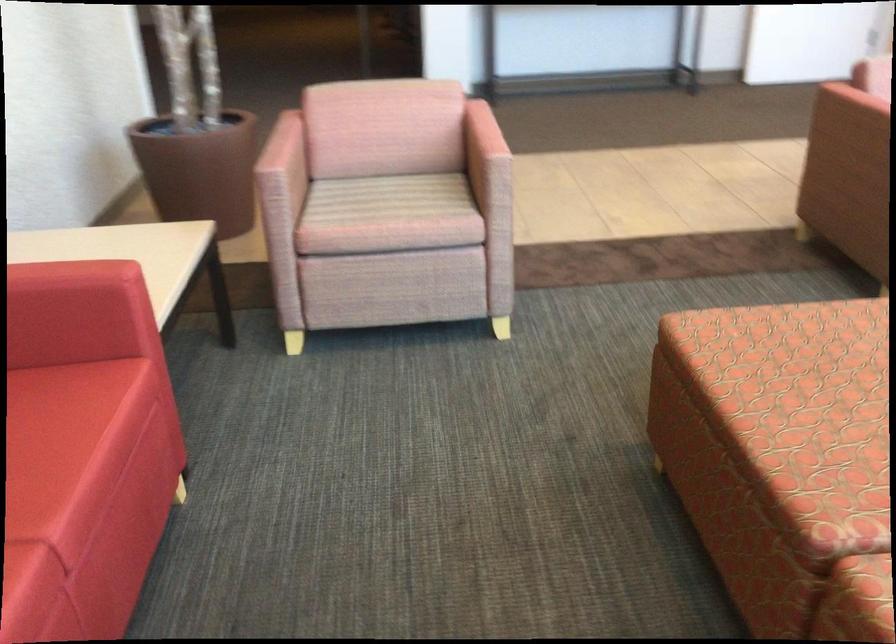
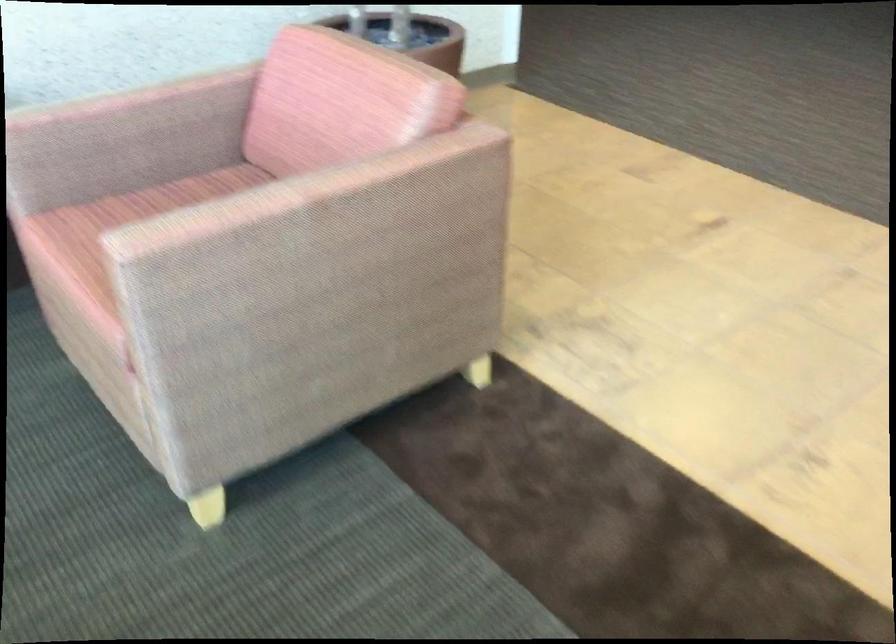
Locate, in the second image, the point that corresponds to the point at 291,142 in the first image.

(121, 98)